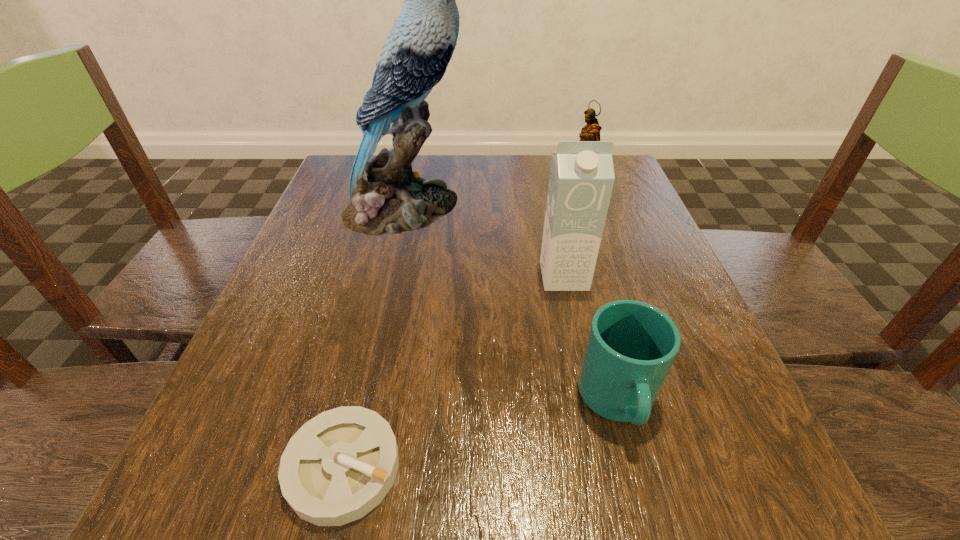
Find the location of a particular element. free space that is in between the figurine and the cup is located at coordinates (598, 301).

Locate an element on the screen. This screenshot has height=540, width=960. vacant area that lies between the ashtray and the fourth tallest object is located at coordinates (480, 434).

Locate an element on the screen. The image size is (960, 540). free area in between the ashtray and the parakeet is located at coordinates (374, 338).

Find the location of a particular element. Image resolution: width=960 pixels, height=540 pixels. free spot between the cup and the tallest object is located at coordinates (512, 305).

Identify the location of vacant space in between the ashtray and the second shortest object. (480, 434).

Identify which object is located as the fourth nearest to the shortest object. Please provide its 2D coordinates. Your answer should be formatted as a tuple, i.e. [(x, y)], where the tuple contains the x and y coordinates of a point satisfying the conditions above.

[(591, 132)]

Find the location of a particular element. the closest object to the parakeet is located at coordinates (581, 180).

Where is `free location that satisfies the following two spatial constraints: 1. on the front-facing side of the third tallest object; 2. on the handle side of the fourth tallest object`? The image size is (960, 540). free location that satisfies the following two spatial constraints: 1. on the front-facing side of the third tallest object; 2. on the handle side of the fourth tallest object is located at coordinates (640, 402).

Find the location of a particular element. This screenshot has width=960, height=540. free spot that satisfies the following two spatial constraints: 1. on the front-facing side of the figurine; 2. on the handle side of the cup is located at coordinates (640, 402).